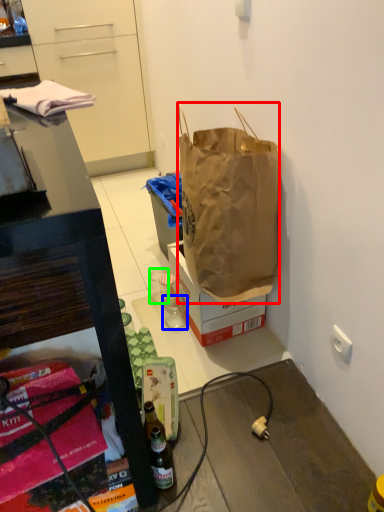
Question: Which object is positioned closest to handbag (highlighted by a red box)? Select from coffee cup (highlighted by a blue box) and coffee cup (highlighted by a green box).

Choices:
 (A) coffee cup
 (B) coffee cup

Answer: (A)